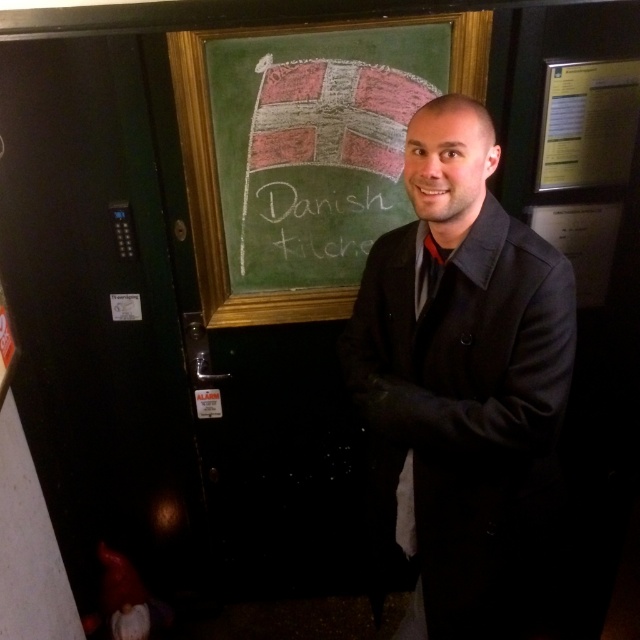
You are a tailor measuring a customer for a new coat. The customer is wearing the dark gray wool coat at center and standing in front of the white chalk writing at center. Which item is wider from your perspective?

The dark gray wool coat at center is wider than the white chalk writing at center.

You are standing in front of the chalkboard and want to touch the point at coordinates point [371,176]. Can you reach it without moving your position? Assume your maximum reach is 5 feet.

The point [371,176] is 5.61 feet away from the viewer. Since your maximum reach is 5 feet, you cannot reach it without moving your position.